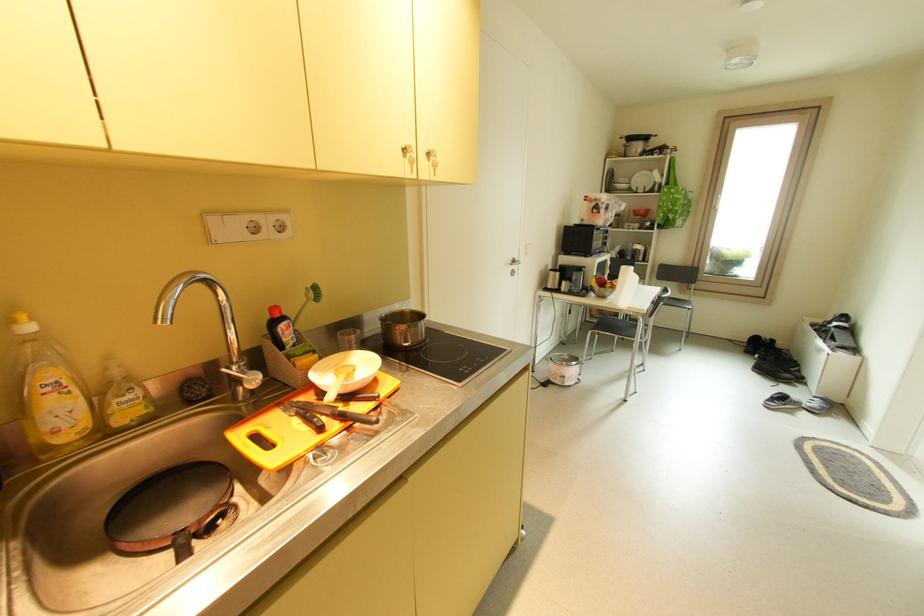
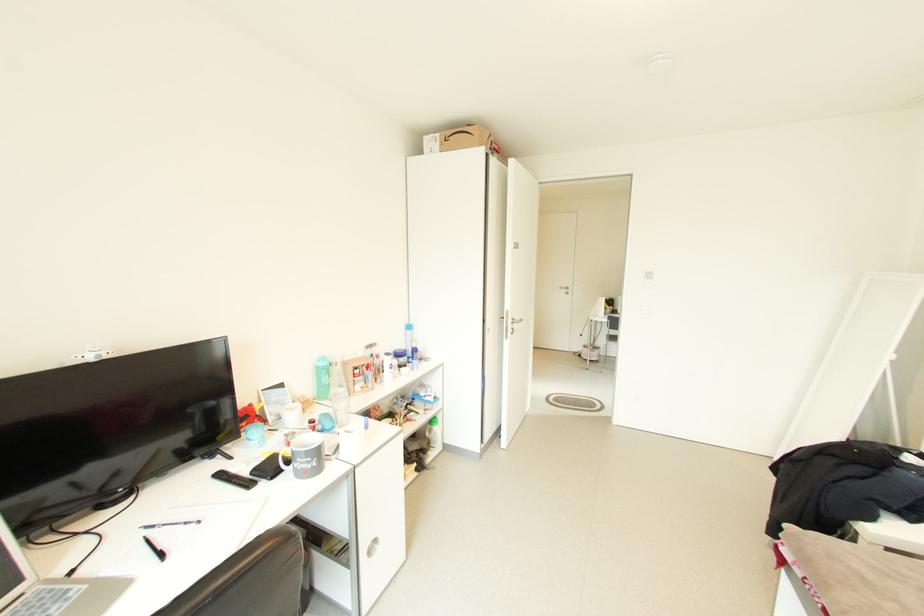
Question: I am providing you with two images of the same scene from different viewpoints. After the viewpoint changes to image2, which objects are now occluded?

Choices:
 (A) round cabinet handle
 (B) pink cardboard box
 (C) black remote control
 (D) chair sitting surface

Answer: (D)